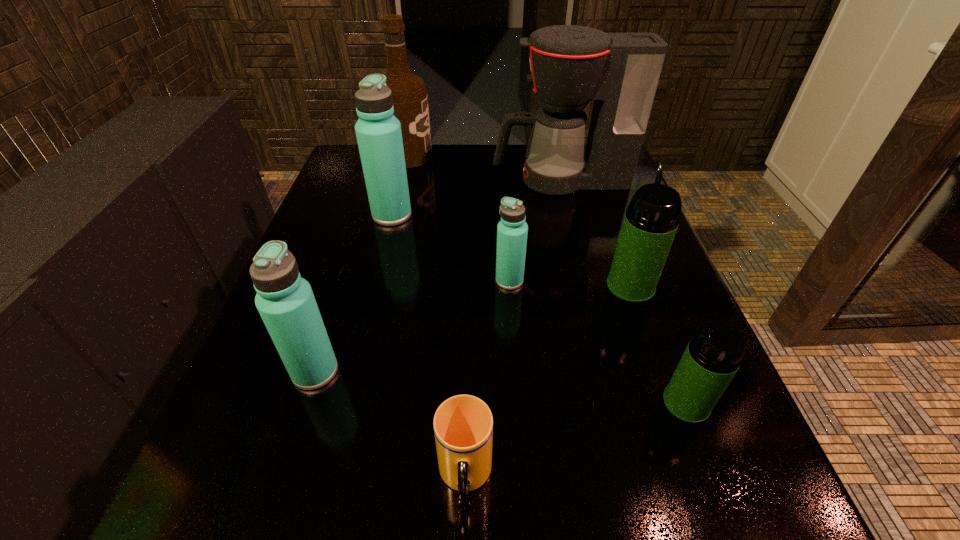
Where is `brown alcohol`? The height and width of the screenshot is (540, 960). brown alcohol is located at coordinates (410, 100).

At what (x,y) coordinates should I click in order to perform the action: click on coffee maker. Please return your answer as a coordinate pair (x, y). The width and height of the screenshot is (960, 540). Looking at the image, I should click on (571, 65).

The image size is (960, 540). Identify the location of the farthest thermos bottle. (378, 131).

Where is `the tallest thermos bottle`? The image size is (960, 540). the tallest thermos bottle is located at coordinates click(x=378, y=131).

At what (x,y) coordinates should I click in order to perform the action: click on the bigger green thermos bottle. Please return your answer as a coordinate pair (x, y). Looking at the image, I should click on (651, 220).

Where is `the nearest aqua thermos bottle`? Image resolution: width=960 pixels, height=540 pixels. the nearest aqua thermos bottle is located at coordinates (285, 301).

You are a GUI agent. You are given a task and a screenshot of the screen. Output one action in this format:
    pyautogui.click(x=<x>, y=<y>)
    Task: Click on the rightmost aqua thermos bottle
    The height and width of the screenshot is (540, 960).
    Given the screenshot: What is the action you would take?
    pyautogui.click(x=512, y=230)

At what (x,y) coordinates should I click in order to perform the action: click on the second nearest aqua thermos bottle. Please return your answer as a coordinate pair (x, y). Looking at the image, I should click on (512, 230).

Where is `the smaller green thermos bottle`? the smaller green thermos bottle is located at coordinates 714,354.

Find the location of a particular element. beige cup is located at coordinates (463, 425).